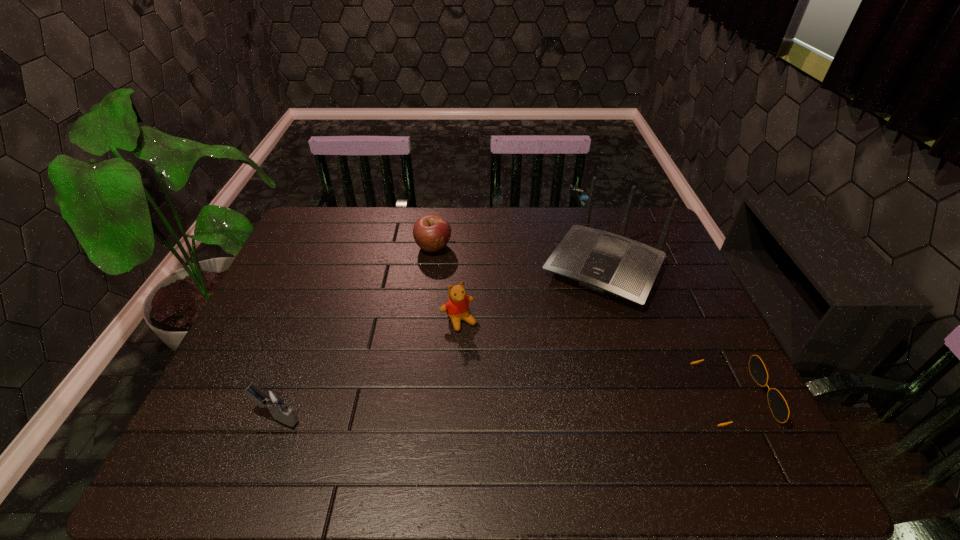
I want to click on free space located on the front-facing side of the router, so click(x=524, y=401).

Find the location of `free space located on the front-facing side of the router`. free space located on the front-facing side of the router is located at coordinates (566, 330).

Identify the location of vacant space positioned on the front-facing side of the teddy bear. This screenshot has width=960, height=540. (476, 348).

Identify the location of free space located 0.230m on the front-facing side of the teddy bear. (510, 400).

Locate an element on the screen. This screenshot has width=960, height=540. vacant space located 0.070m on the front-facing side of the teddy bear is located at coordinates (478, 350).

At what (x,y) coordinates should I click in order to perform the action: click on apple at the far edge. Please return your answer as a coordinate pair (x, y). The width and height of the screenshot is (960, 540). Looking at the image, I should click on (431, 232).

This screenshot has width=960, height=540. I want to click on router positioned at the far edge, so click(601, 261).

At what (x,y) coordinates should I click in order to perform the action: click on igniter positioned at the near edge. Please return your answer as a coordinate pair (x, y). This screenshot has width=960, height=540. Looking at the image, I should click on (271, 400).

The width and height of the screenshot is (960, 540). In order to click on sunglasses that is at the near edge in this screenshot , I will do `click(778, 405)`.

This screenshot has height=540, width=960. In order to click on object that is at the left edge in this screenshot , I will do `click(271, 400)`.